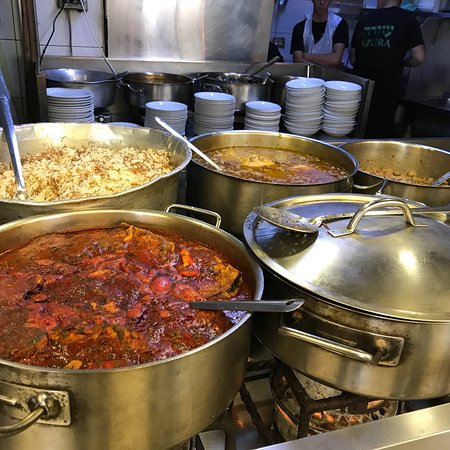
At what (x,y) coordinates should I click in order to perform the action: click on spoon handle in pot. Please return your answer as a coordinate pair (x, y). This screenshot has height=450, width=450. Looking at the image, I should click on (272, 303).